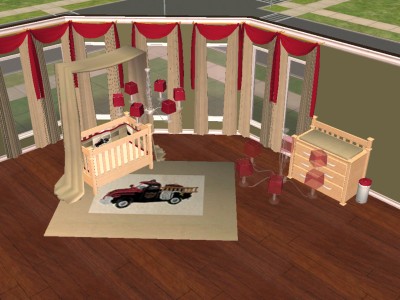
Where is `area rug`? This screenshot has width=400, height=300. area rug is located at coordinates (x=173, y=220).